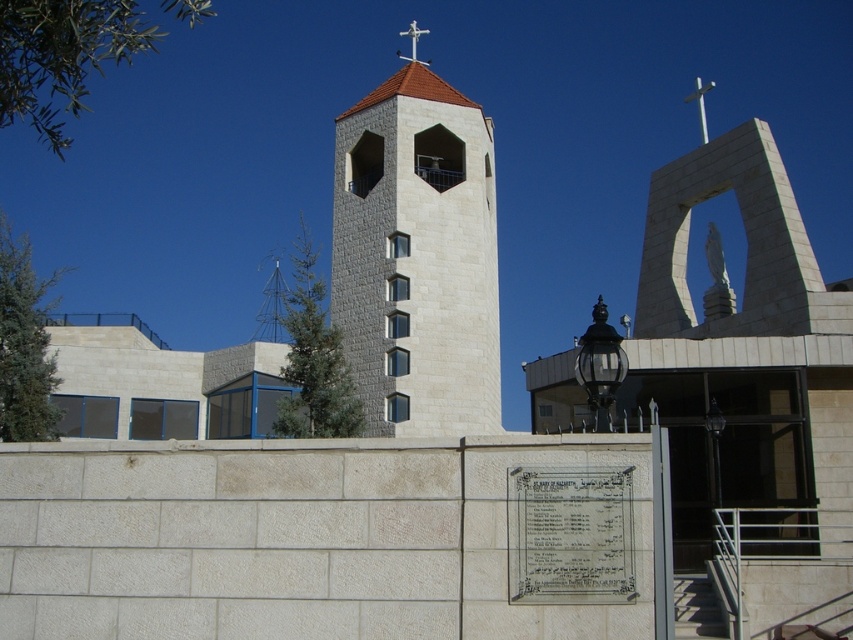
Question: Observing the image, what is the correct spatial positioning of beige stone bell tower at center in reference to white stone plaque at center?

Choices:
 (A) above
 (B) below

Answer: (A)

Question: Which of the following is the closest to the observer?

Choices:
 (A) (434, 196)
 (B) (598, 596)

Answer: (B)

Question: Observing the image, what is the correct spatial positioning of beige stone bell tower at center in reference to white stone plaque at center?

Choices:
 (A) right
 (B) left

Answer: (B)

Question: Does beige stone bell tower at center have a smaller size compared to white stone plaque at center?

Choices:
 (A) yes
 (B) no

Answer: (B)

Question: Which point appears closest to the camera in this image?

Choices:
 (A) (538, 593)
 (B) (396, 348)

Answer: (A)